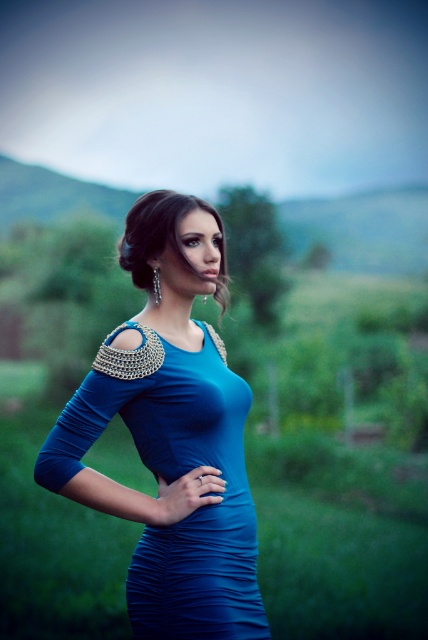
Can you confirm if matte blue dress at center is positioned below satin blue dress at center?

Yes, matte blue dress at center is below satin blue dress at center.

Does matte blue dress at center have a smaller size compared to satin blue dress at center?

Actually, matte blue dress at center might be larger than satin blue dress at center.

Who is more distant from viewer, (253, 545) or (128, 214)?

The point (128, 214) is behind.

In order to click on matte blue dress at center in this screenshot , I will do `click(171, 435)`.

Which is below, matte blue dress at center or ruched satin dress at center?

ruched satin dress at center

Is matte blue dress at center wider than ruched satin dress at center?

Correct, the width of matte blue dress at center exceeds that of ruched satin dress at center.

Between point (207, 573) and point (249, 636), which one is positioned in front?

Point (249, 636)

You are a GUI agent. You are given a task and a screenshot of the screen. Output one action in this format:
    pyautogui.click(x=<x>, y=<y>)
    Task: Click on the matte blue dress at center
    
    Given the screenshot: What is the action you would take?
    pyautogui.click(x=171, y=435)

Consider the image. How distant is ruched satin dress at center from satin blue dress at center?

They are 86.47 centimeters apart.

Which of these two, ruched satin dress at center or satin blue dress at center, stands shorter?

ruched satin dress at center

Which is in front, point (148, 534) or point (220, 292)?

Point (148, 534)

The width and height of the screenshot is (428, 640). In order to click on ruched satin dress at center in this screenshot , I will do `click(195, 584)`.